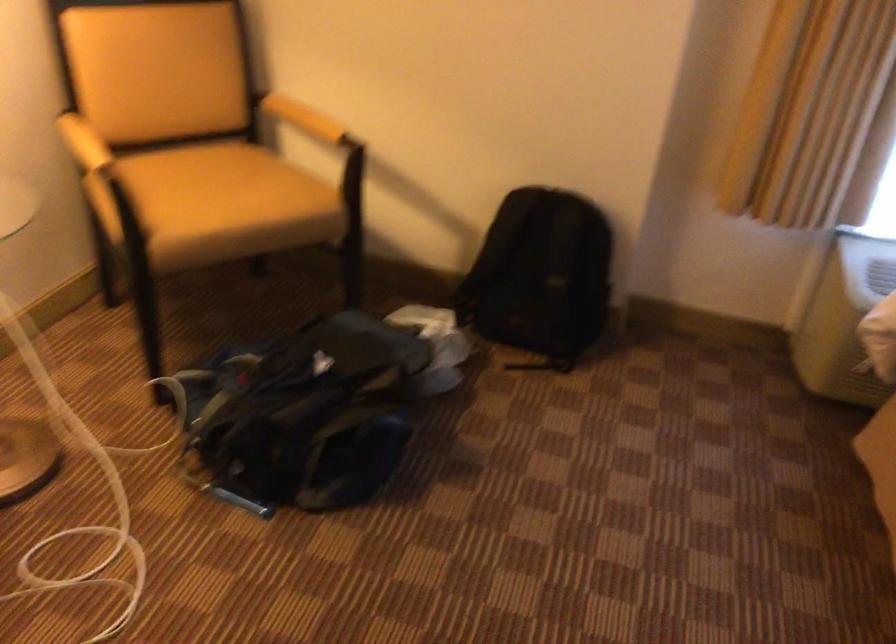
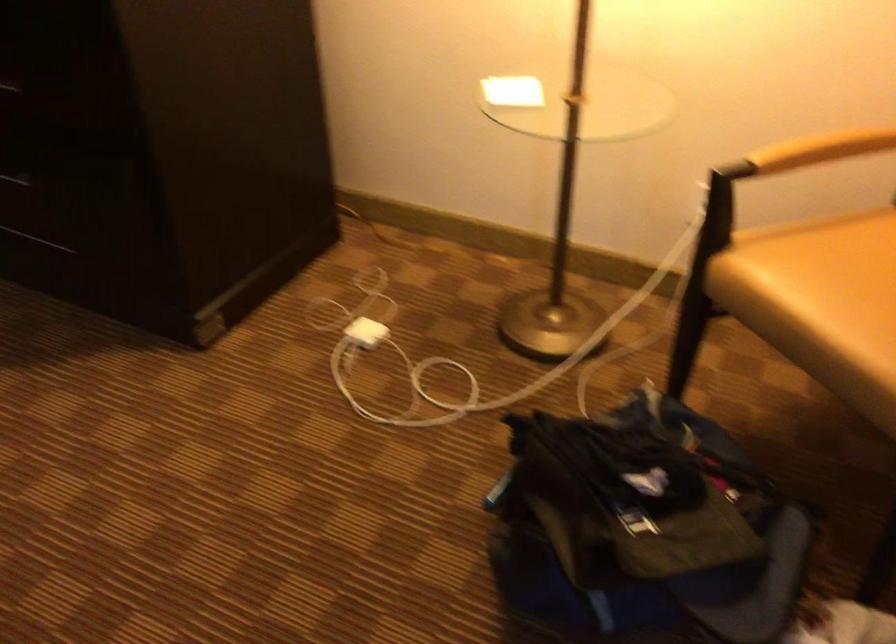
In the second image, find the point that corresponds to [118,135] in the first image.

(821, 149)